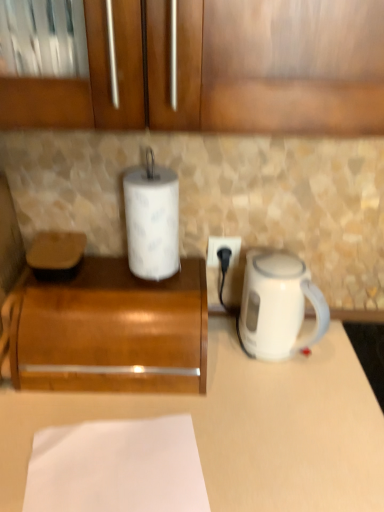
Identify the location of free space to the left of white paper at center. The image size is (384, 512). (91, 279).